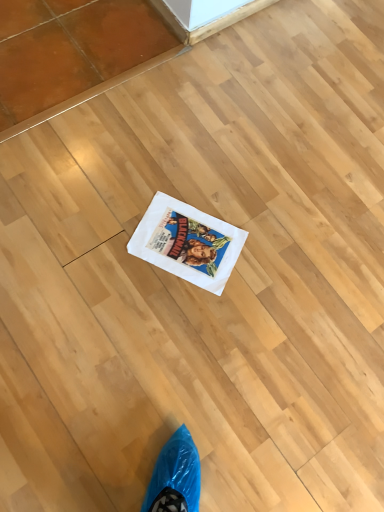
Identify the location of vacant space to the left of white paper comic book at center. (111, 217).